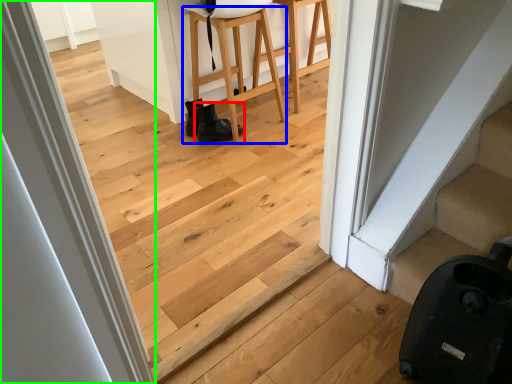
Question: Estimate the real-world distances between objects in this image. Which object is farther from footwear (highlighted by a red box), furniture (highlighted by a blue box) or door (highlighted by a green box)?

Choices:
 (A) furniture
 (B) door

Answer: (B)